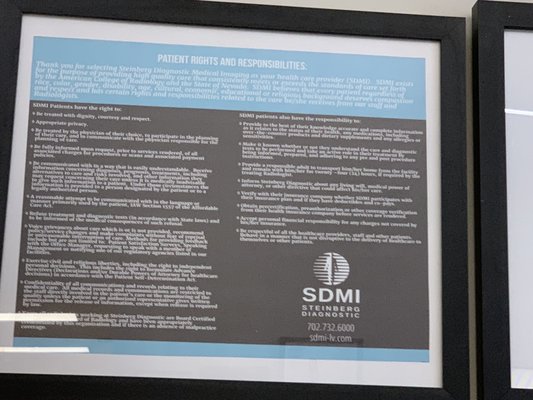
Locate an element on the screen. The image size is (533, 400). frame is located at coordinates (453, 273).